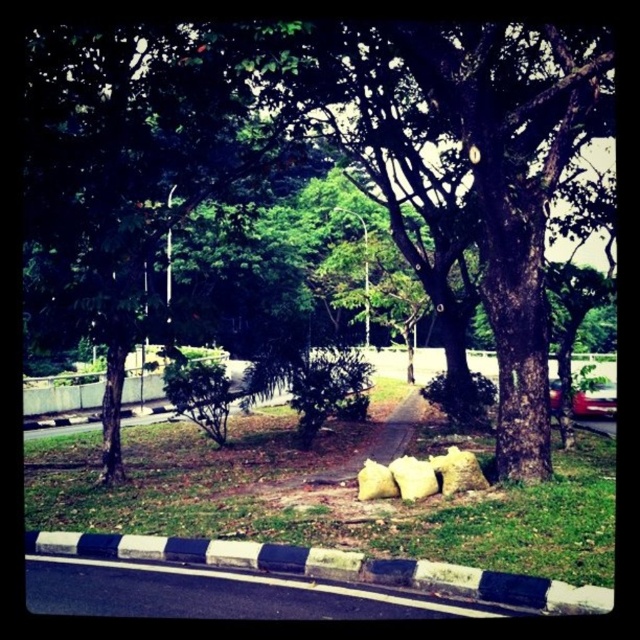
Question: In this image, where is green grass at lower center located relative to black and white concrete curb at lower center?

Choices:
 (A) right
 (B) left

Answer: (B)

Question: Which is farther from the black and white concrete curb at lower center?

Choices:
 (A) metallic red car at center-right
 (B) brown rough tree at center
 (C) green grass at lower center

Answer: (A)

Question: Estimate the real-world distances between objects in this image. Which object is closer to the brown rough tree at center?

Choices:
 (A) green grass at lower center
 (B) metallic red car at center-right

Answer: (A)

Question: Is brown rough tree at center smaller than green grass at lower center?

Choices:
 (A) yes
 (B) no

Answer: (B)

Question: Does green grass at lower center have a lesser width compared to metallic red car at center-right?

Choices:
 (A) yes
 (B) no

Answer: (B)

Question: Which object is positioned closest to the green grass at lower center?

Choices:
 (A) brown rough tree at center
 (B) black and white concrete curb at lower center
 (C) metallic red car at center-right

Answer: (B)